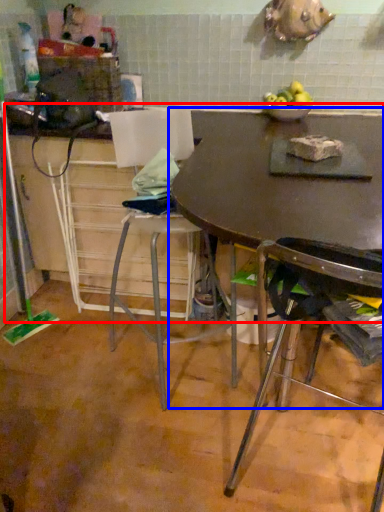
Question: Which of the following is the closest to the observer, counter top (highlighted by a red box) or table (highlighted by a blue box)?

Choices:
 (A) counter top
 (B) table

Answer: (B)